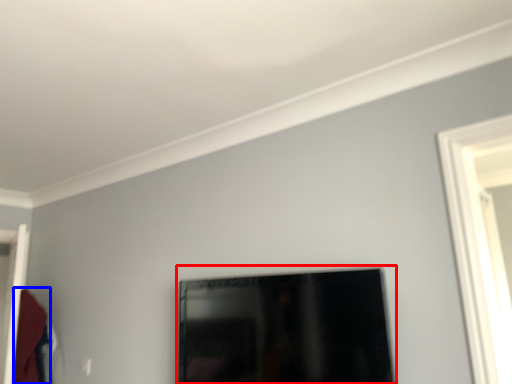
Question: Which of the following is the farthest to the observer, picture frame (highlighted by a red box) or robe (highlighted by a blue box)?

Choices:
 (A) picture frame
 (B) robe

Answer: (B)